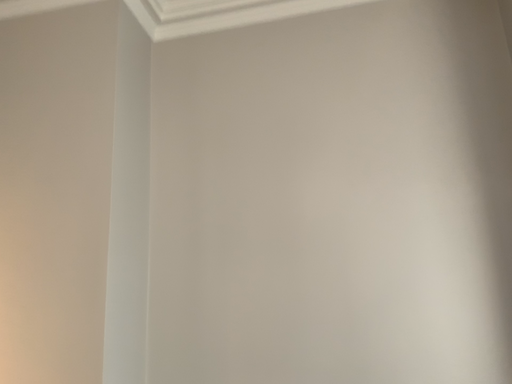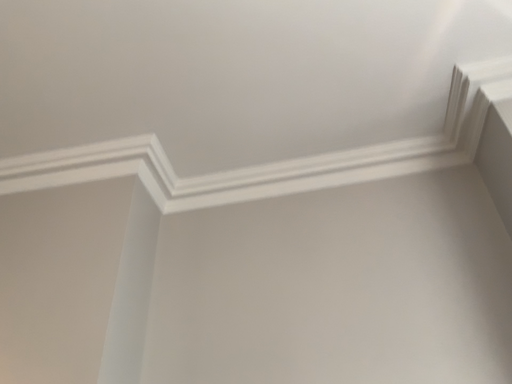
Question: How did the camera likely rotate when shooting the video?

Choices:
 (A) rotated downward
 (B) rotated upward

Answer: (B)